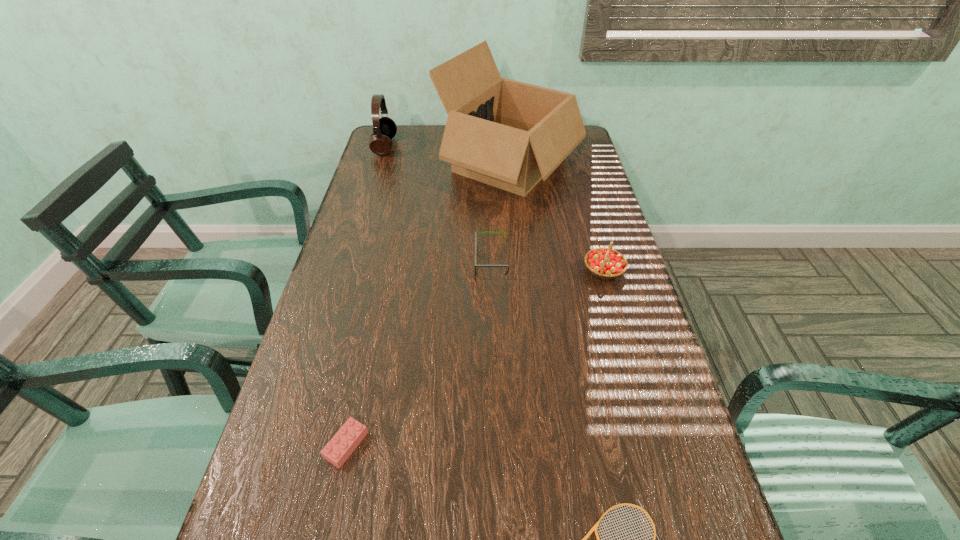
Where is `object that stands as the fourth closest to the Lego`? object that stands as the fourth closest to the Lego is located at coordinates (508, 134).

Select which object is the third closest to the third tallest object. Please provide its 2D coordinates. Your answer should be formatted as a tuple, i.e. [(x, y)], where the tuple contains the x and y coordinates of a point satisfying the conditions above.

[(594, 528)]

At what (x,y) coordinates should I click in order to perform the action: click on free region that satisfies the following two spatial constraints: 1. on the front side of the tallest object; 2. on the lens of the third shortest object. Please return your answer as a coordinate pair (x, y). Looking at the image, I should click on 519,261.

Locate an element on the screen. This screenshot has width=960, height=540. free location that satisfies the following two spatial constraints: 1. on the back side of the second nearest object; 2. on the ear pads of the leftmost object is located at coordinates (412, 146).

The image size is (960, 540). Find the location of `vacant space that satisfies the following two spatial constraints: 1. on the lens of the spectacles; 2. on the right side of the third tallest object`. vacant space that satisfies the following two spatial constraints: 1. on the lens of the spectacles; 2. on the right side of the third tallest object is located at coordinates (492, 270).

The width and height of the screenshot is (960, 540). I want to click on blank area in the image that satisfies the following two spatial constraints: 1. on the back side of the third tallest object; 2. on the ear pads of the headset, so click(568, 146).

The image size is (960, 540). I want to click on free space that satisfies the following two spatial constraints: 1. on the ear pads of the headset; 2. on the right side of the fifth farthest object, so click(294, 445).

Locate an element on the screen. The height and width of the screenshot is (540, 960). vacant space that satisfies the following two spatial constraints: 1. on the lens of the spectacles; 2. on the right side of the fourth shortest object is located at coordinates (492, 270).

Identify the location of vacant space that satisfies the following two spatial constraints: 1. on the ear pads of the second tallest object; 2. on the back side of the fourth shortest object. This screenshot has width=960, height=540. (347, 270).